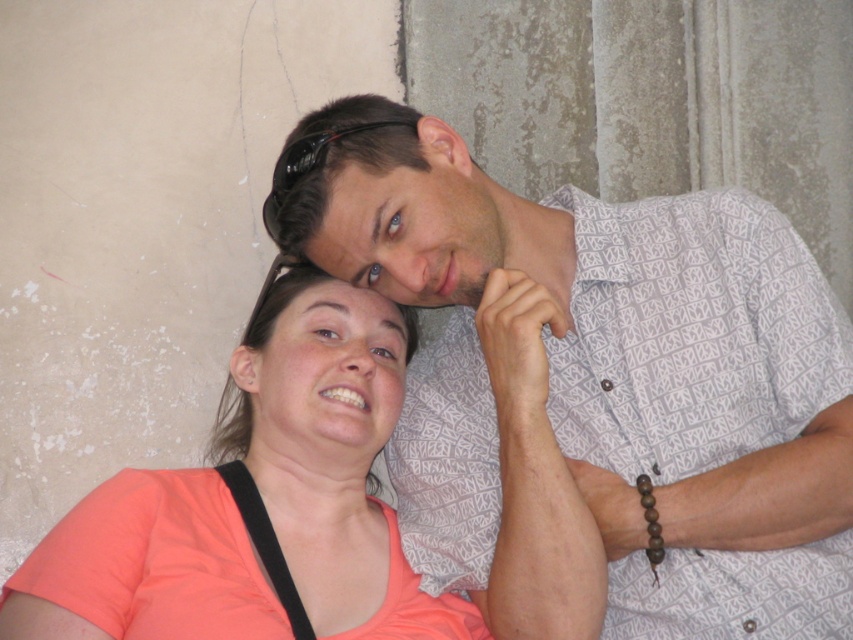
Question: Does white printed shirt at upper center have a greater width compared to coral matte shirt at center?

Choices:
 (A) yes
 (B) no

Answer: (A)

Question: Among these objects, which one is farthest from the camera?

Choices:
 (A) white printed shirt at upper center
 (B) coral matte shirt at center

Answer: (A)

Question: Does white printed shirt at upper center have a larger size compared to coral matte shirt at center?

Choices:
 (A) yes
 (B) no

Answer: (A)

Question: Is white printed shirt at upper center above coral matte shirt at center?

Choices:
 (A) no
 (B) yes

Answer: (B)

Question: Which object appears farthest from the camera in this image?

Choices:
 (A) white printed shirt at upper center
 (B) coral matte shirt at center

Answer: (A)